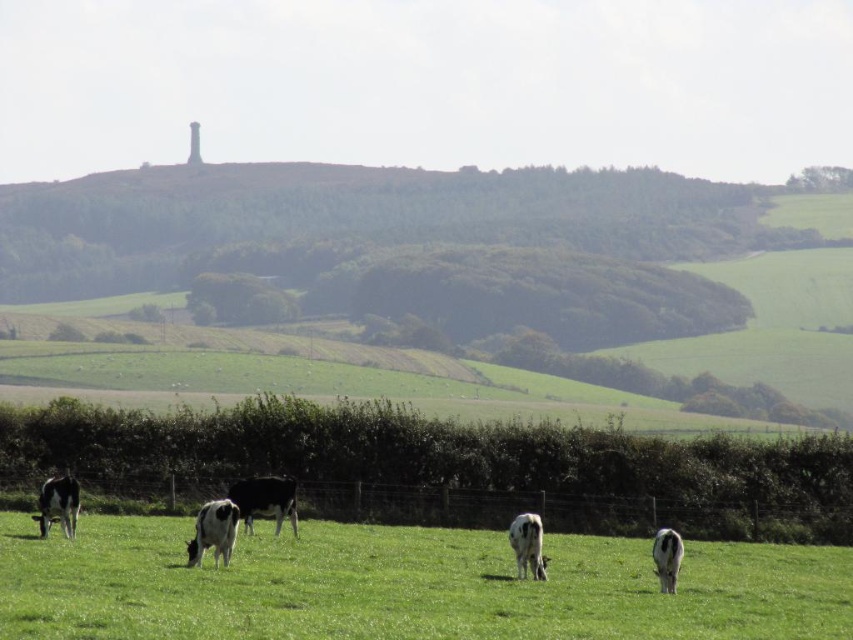
You are a farmer who wants to fit both the black glossy cow at center and the white glossy cow at center into a 1.5 meter wide gate. Based on their sizes, will both cows fit through the gate at the same time?

The black glossy cow at center is wider than the white glossy cow at center. Since the gate is only 1.5 meters wide, and the black glossy cow at center alone may already exceed that width, both cows cannot fit through the gate simultaneously.

You are standing at the edge of the green grassy field at lower center and want to walk to the black and white spotted cow at lower left. Which direction should you head?

The black and white spotted cow at lower left is located to the left side of the green grassy field at lower center, so you should head towards the left to reach it.

You are standing at the point with coordinates point (57,506) in the image. What object are you standing on?

You are standing on the black glossy cow at lower left.